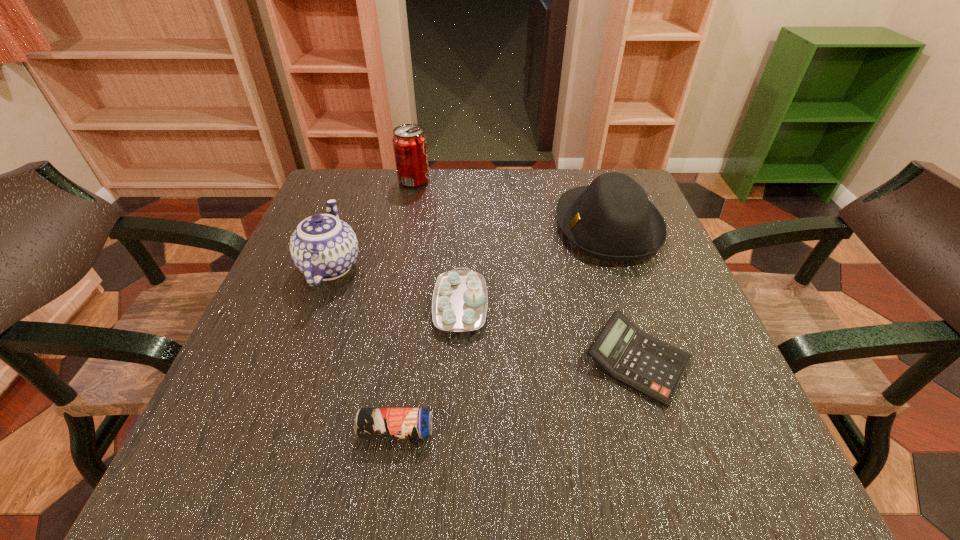
Where is `pop soda`? pop soda is located at coordinates (409, 141).

At what (x,y) coordinates should I click in order to perform the action: click on the leftmost object. Please return your answer as a coordinate pair (x, y). The width and height of the screenshot is (960, 540). Looking at the image, I should click on (323, 247).

Identify the location of the taller chinaware. (323, 247).

Locate an element on the screen. This screenshot has width=960, height=540. fedora is located at coordinates (612, 219).

You are a GUI agent. You are given a task and a screenshot of the screen. Output one action in this format:
    pyautogui.click(x=<x>, y=<y>)
    Task: Click on the right chinaware
    The image size is (960, 540).
    Given the screenshot: What is the action you would take?
    pyautogui.click(x=460, y=300)

Where is `the fourth tallest object`? The height and width of the screenshot is (540, 960). the fourth tallest object is located at coordinates (460, 300).

At what (x,y) coordinates should I click in order to perform the action: click on beer can. Please return your answer as a coordinate pair (x, y). Image resolution: width=960 pixels, height=540 pixels. Looking at the image, I should click on (370, 423).

Where is `the shortest object`? This screenshot has width=960, height=540. the shortest object is located at coordinates (652, 367).

Where is `free location located on the right of the pop soda`? The height and width of the screenshot is (540, 960). free location located on the right of the pop soda is located at coordinates (474, 180).

Locate an element on the screen. This screenshot has height=540, width=960. blank area located 0.220m at the spout of the left chinaware is located at coordinates (361, 184).